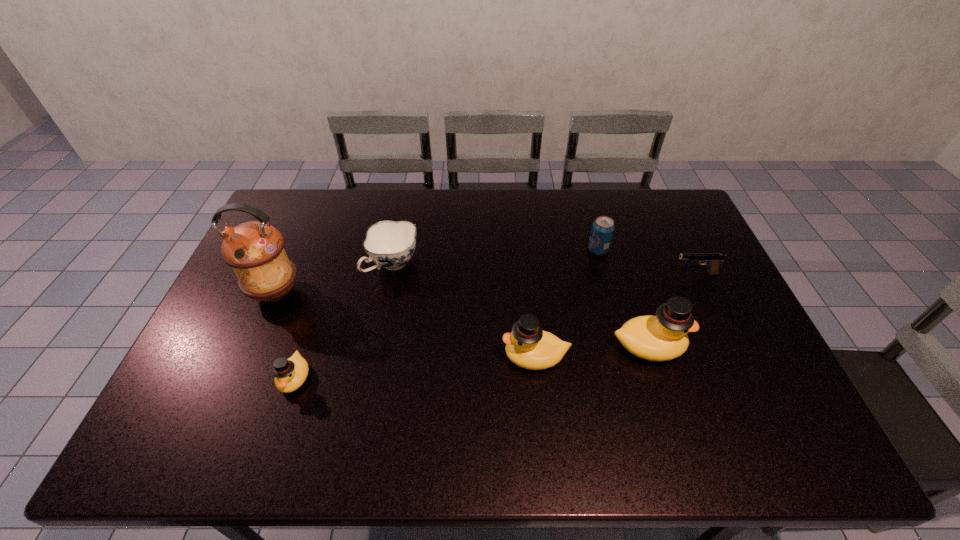
Locate an element on the screen. The width and height of the screenshot is (960, 540). vacant space located 0.300m at the muzzle of the pistol is located at coordinates (578, 274).

Locate an element on the screen. object that is at the near edge is located at coordinates (290, 374).

Identify the location of object positioned at the left edge. (255, 250).

Where is `object situated at the right edge`? This screenshot has width=960, height=540. object situated at the right edge is located at coordinates (713, 260).

Identify the location of free region at the far edge of the desktop. (626, 211).

Locate an element on the screen. vacant area at the near edge is located at coordinates (331, 383).

You are a GUI agent. You are given a task and a screenshot of the screen. Output one action in this format:
    pyautogui.click(x=<x>, y=<y>)
    Task: Click on the vacant region at the left edge of the desktop
    
    Given the screenshot: What is the action you would take?
    pyautogui.click(x=253, y=352)

You are a GUI agent. You are given a task and a screenshot of the screen. Output one action in this format:
    pyautogui.click(x=<x>, y=<y>)
    Task: Click on the vacant space at the right edge
    The height and width of the screenshot is (540, 960).
    Given the screenshot: What is the action you would take?
    pyautogui.click(x=740, y=343)

The width and height of the screenshot is (960, 540). Identify the location of free space at the near left corner of the desktop. (191, 394).

Where is `vacant space at the far right corner`? The width and height of the screenshot is (960, 540). vacant space at the far right corner is located at coordinates (650, 195).